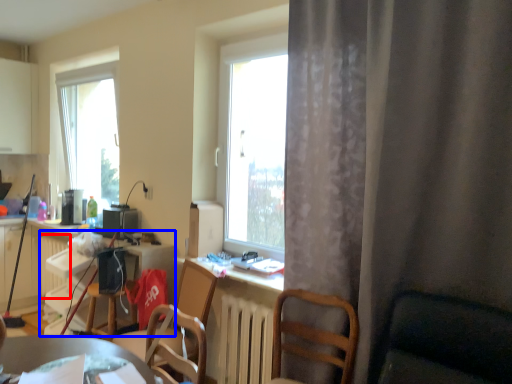
Question: Which point is further to the camera, radiator (highlighted by a red box) or computer desk (highlighted by a blue box)?

Choices:
 (A) radiator
 (B) computer desk

Answer: (A)